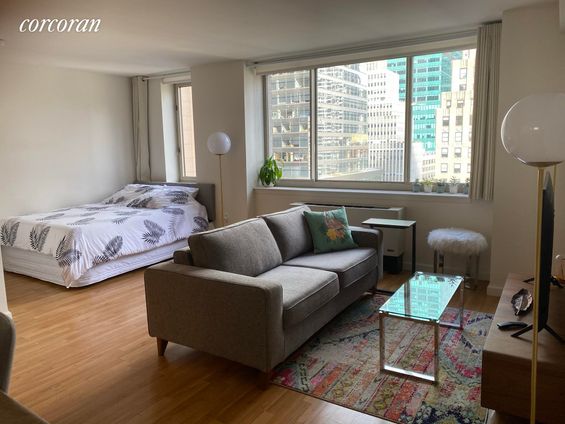
The width and height of the screenshot is (565, 424). I want to click on ceiling, so click(102, 63).